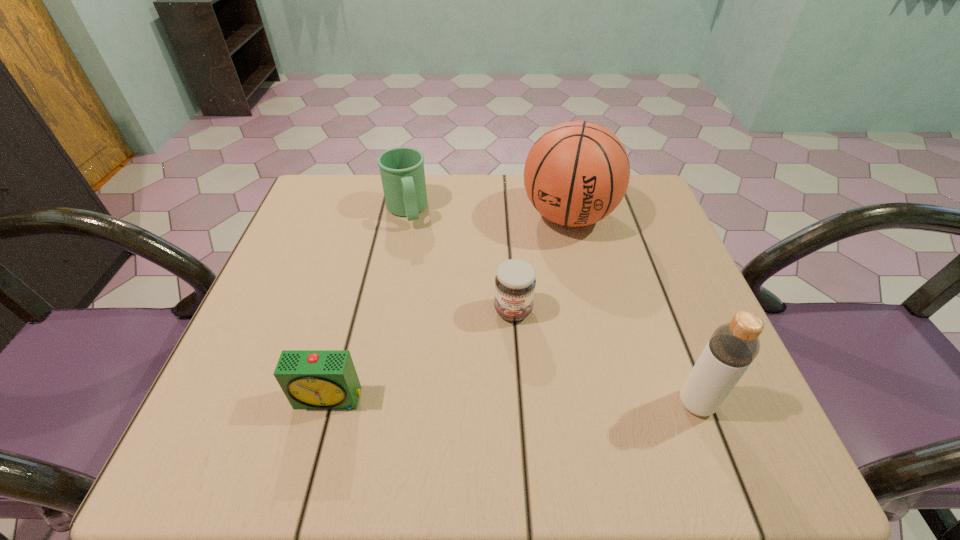
The image size is (960, 540). I want to click on free space on the desktop that is between the alarm clock and the bottle and is positioned on the surface of the basketball near the brand logo, so click(527, 401).

Locate an element on the screen. free space on the desktop that is between the alarm clock and the bottle and is positioned on the front label of the third farthest object is located at coordinates (510, 401).

Identify the location of free space on the desktop that is between the alarm clock and the bottle and is positioned on the side of the third tallest object with the handle. (465, 400).